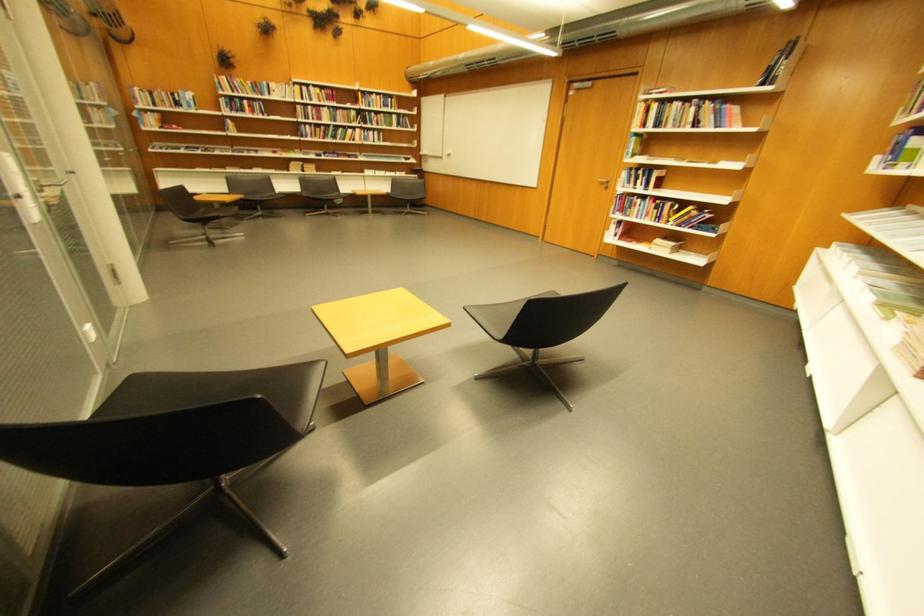
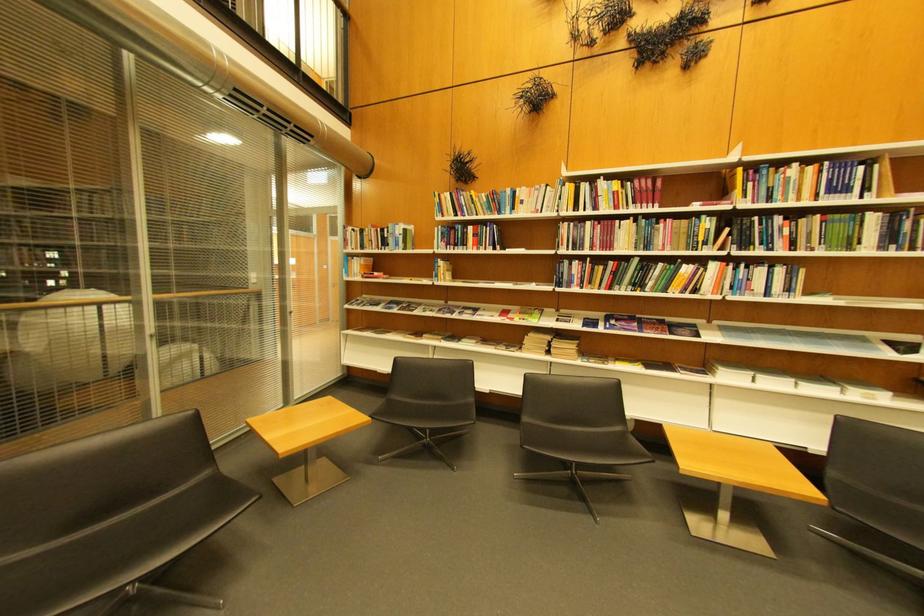
In the second image, find the point that corresponds to point 335,92 in the first image.

(648, 183)